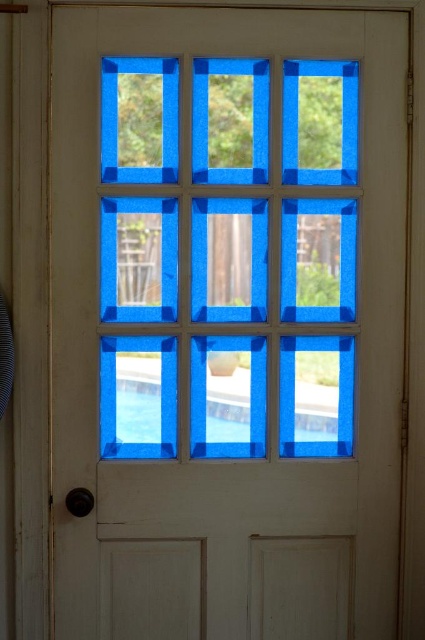
You are standing in front of the white door with nine windows. You see the transparent blue glass at center and the transparent glass pool at center. Which one is positioned more to the left?

The transparent blue glass at center is positioned to the left of the transparent glass pool at center, so it is more to the left.